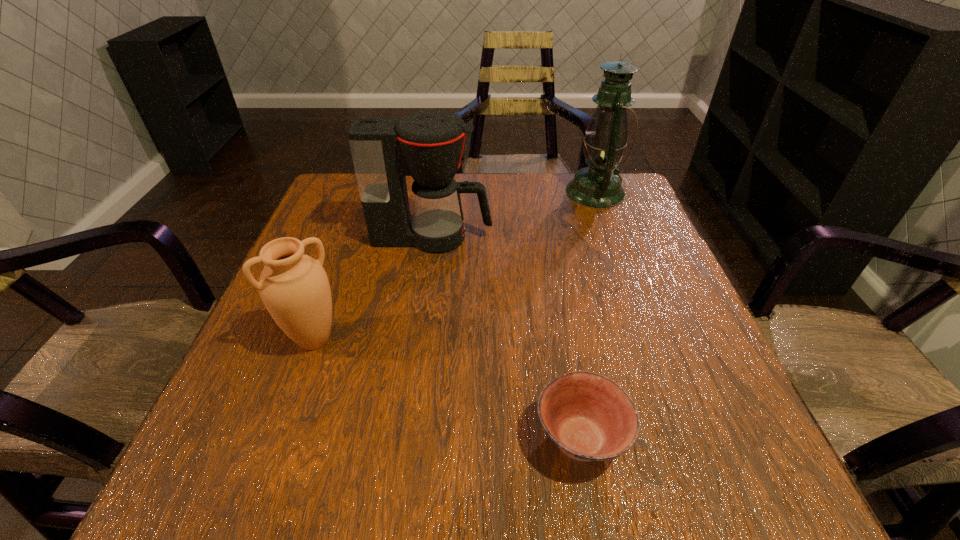
Locate an element on the screen. vacant area situated on the right of the urn is located at coordinates (550, 340).

Where is `vacant space located 0.090m on the right of the nearest object`? vacant space located 0.090m on the right of the nearest object is located at coordinates (684, 438).

Locate an element on the screen. This screenshot has height=540, width=960. oil lamp present at the far edge is located at coordinates (598, 186).

Where is `coffee maker at the far edge`? coffee maker at the far edge is located at coordinates (428, 145).

The height and width of the screenshot is (540, 960). What are the coordinates of `object situated at the near edge` in the screenshot? It's located at pos(588,416).

Identify the location of object that is at the left edge. coord(294,287).

Locate an element on the screen. This screenshot has height=540, width=960. object that is at the right edge is located at coordinates (598, 186).

Find the location of a particular element. object present at the far right corner is located at coordinates (598, 186).

Locate an element on the screen. The width and height of the screenshot is (960, 540). vacant space at the far edge is located at coordinates (550, 208).

The height and width of the screenshot is (540, 960). In the image, there is a desktop. In order to click on free region at the near edge in this screenshot , I will do `click(388, 498)`.